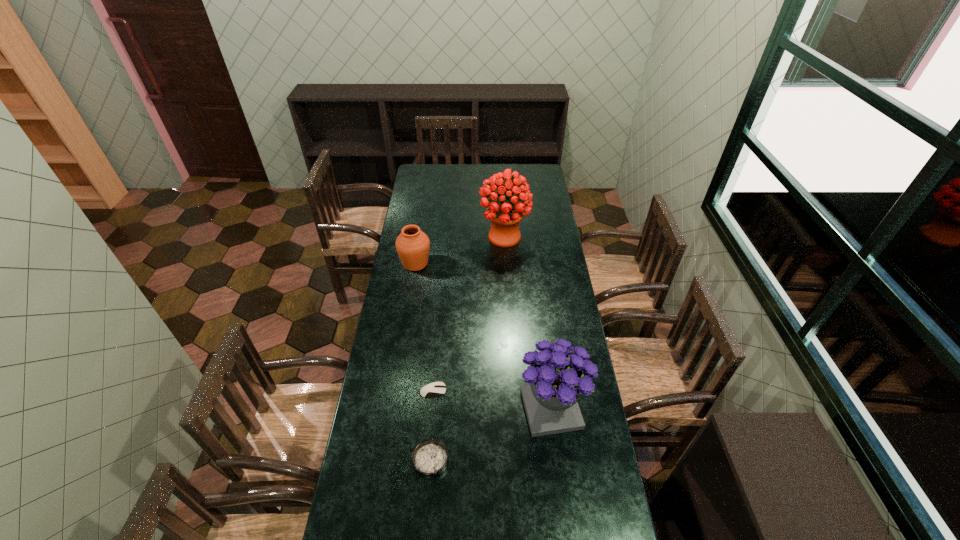
Locate an element on the screen. free space in the image that satisfies the following two spatial constraints: 1. on the front side of the ashtray; 2. on the left side of the third shortest object is located at coordinates (384, 461).